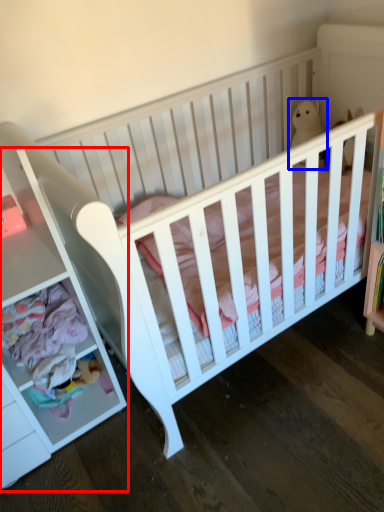
Question: Which point is closer to the camera, dresser (highlighted by a red box) or animal (highlighted by a blue box)?

Choices:
 (A) dresser
 (B) animal

Answer: (A)